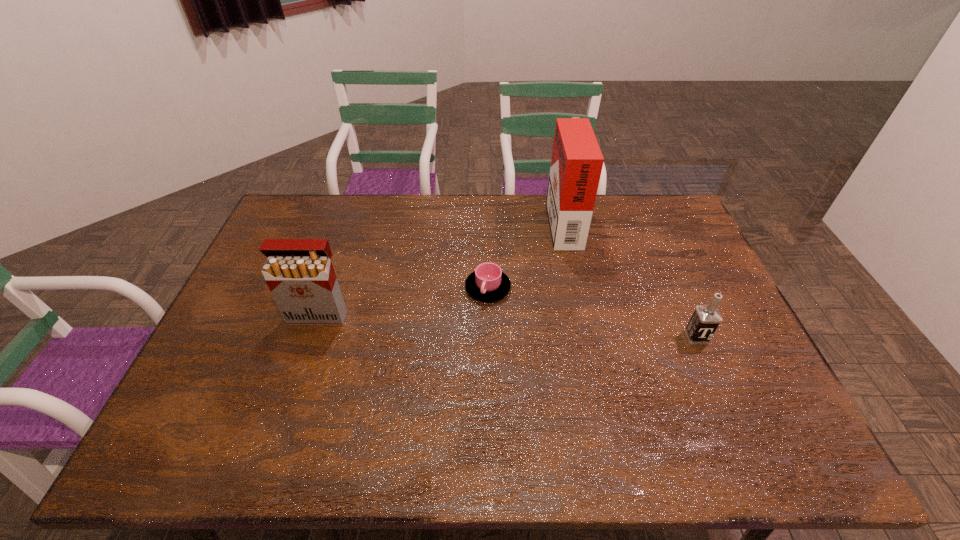
Where is `free region located 0.220m on the front-facing side of the taller cigarette case`? The image size is (960, 540). free region located 0.220m on the front-facing side of the taller cigarette case is located at coordinates (488, 221).

Identify the location of vacant space located 0.070m with the lid open on the nearer cigarette case. (308, 346).

Locate an element on the screen. vacant position located 0.220m on the front label of the third tallest object is located at coordinates (x=732, y=421).

This screenshot has width=960, height=540. I want to click on vacant space located 0.180m on the side with the handle of the third nearest object, so click(x=489, y=356).

The image size is (960, 540). Identify the location of object located in the far edge section of the desktop. (576, 164).

Locate an element on the screen. object located in the right edge section of the desktop is located at coordinates (705, 320).

In the image, there is a desktop. Identify the location of vacant region at the far edge. This screenshot has height=540, width=960. (546, 235).

The width and height of the screenshot is (960, 540). Identify the location of vacant region at the near edge of the desktop. (664, 450).

In the image, there is a desktop. Where is `vacant region at the left edge`? vacant region at the left edge is located at coordinates pos(239,366).

In order to click on free space at the right edge of the desktop in this screenshot , I will do `click(708, 286)`.